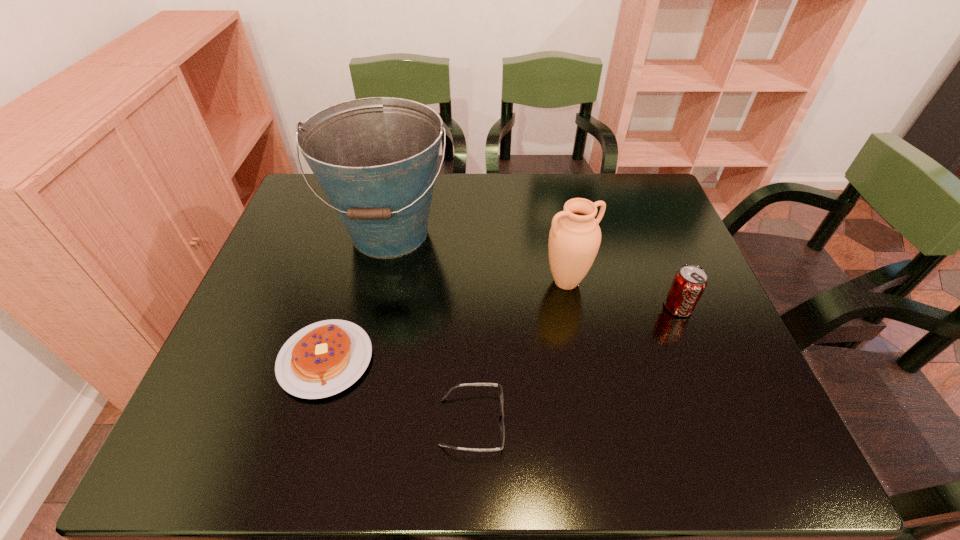
You are a GUI agent. You are given a task and a screenshot of the screen. Output one action in this format:
    pyautogui.click(x=<x>, y=<y>)
    Task: Click on the tallest object
    The width and height of the screenshot is (960, 540).
    Given the screenshot: What is the action you would take?
    pyautogui.click(x=376, y=158)

I want to click on the fourth object from left to right, so click(574, 239).

Locate an element on the screen. the fourth shortest object is located at coordinates (574, 239).

Find the location of a particular element. The width and height of the screenshot is (960, 540). the rightmost object is located at coordinates (689, 283).

Find the location of a particular element. pop soda is located at coordinates (689, 283).

Locate an element on the screen. The image size is (960, 540). the second shortest object is located at coordinates (322, 359).

This screenshot has width=960, height=540. What are the coordinates of `the third object from right to left` in the screenshot? It's located at (502, 427).

Locate an element on the screen. the shortest object is located at coordinates (502, 427).

What are the coordinates of `vacant space located with the handle on opposite sides of the tallest object` in the screenshot? It's located at (351, 411).

Image resolution: width=960 pixels, height=540 pixels. I want to click on free spot located on the left of the urn, so click(483, 282).